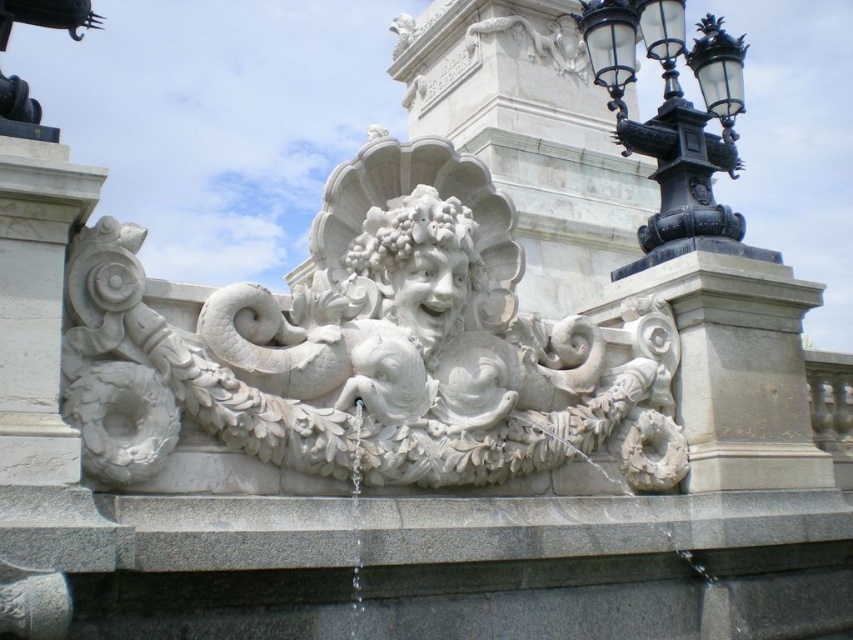
You are standing in front of the fountain and notice two points marked on the sculpted face. The first point is at coordinates point (300,337) and the second is at point (440,257). Which point is closer to you?

Point (300,337) is closer to the camera than point (440,257), so the first point is closer to you.

You are an architect designing a new plaza and want to place a bench between the white marble sculpture at center and the white stone deity at center. If the bench requires 1.2 meters of space, can it fit between them?

The white marble sculpture at center is wider than the white stone deity at center, but the exact distance between them isn